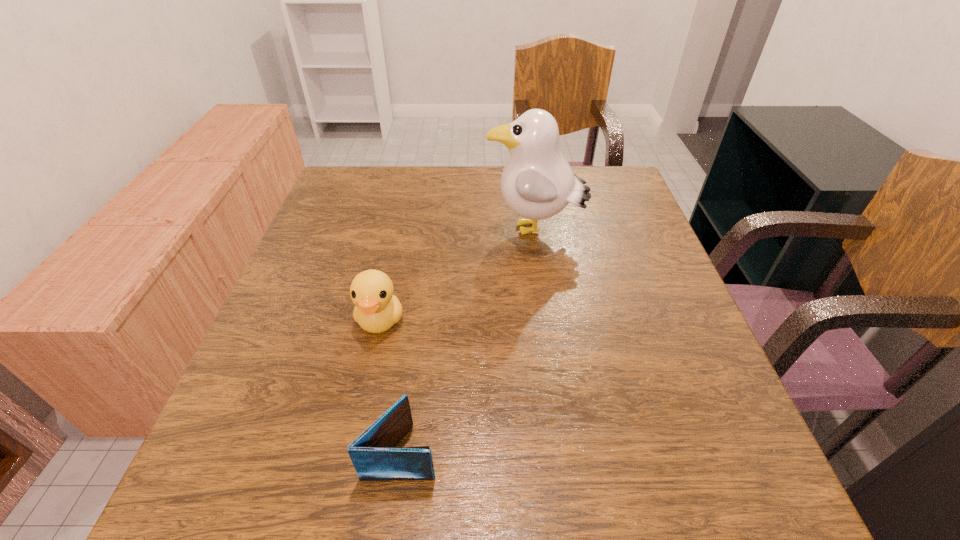
I want to click on free space that is in between the gull and the duck, so click(457, 275).

Identify the location of vacant region between the second shortest object and the wallet. (391, 386).

Image resolution: width=960 pixels, height=540 pixels. I want to click on empty location between the second nearest object and the nearest object, so click(x=391, y=386).

Image resolution: width=960 pixels, height=540 pixels. Find the location of `vacant space in between the tallest object and the duck`. vacant space in between the tallest object and the duck is located at coordinates (457, 275).

At what (x,y) coordinates should I click in order to perform the action: click on free spot between the shortest object and the gull. Please return your answer as a coordinate pair (x, y). The width and height of the screenshot is (960, 540). Looking at the image, I should click on (468, 341).

At what (x,y) coordinates should I click in order to perform the action: click on vacant area between the second farthest object and the wallet. Please return your answer as a coordinate pair (x, y). Looking at the image, I should click on (391, 386).

Image resolution: width=960 pixels, height=540 pixels. Find the location of `vacant space that is in between the shortest object and the gull`. vacant space that is in between the shortest object and the gull is located at coordinates (468, 341).

Where is `vacant area that lies between the second farthest object and the rightmost object`? vacant area that lies between the second farthest object and the rightmost object is located at coordinates (457, 275).

Identify which object is located as the second nearest to the wallet. Please provide its 2D coordinates. Your answer should be formatted as a tuple, i.e. [(x, y)], where the tuple contains the x and y coordinates of a point satisfying the conditions above.

[(537, 182)]

The height and width of the screenshot is (540, 960). What are the coordinates of `object that ranks as the closest to the tallest object` in the screenshot? It's located at (377, 309).